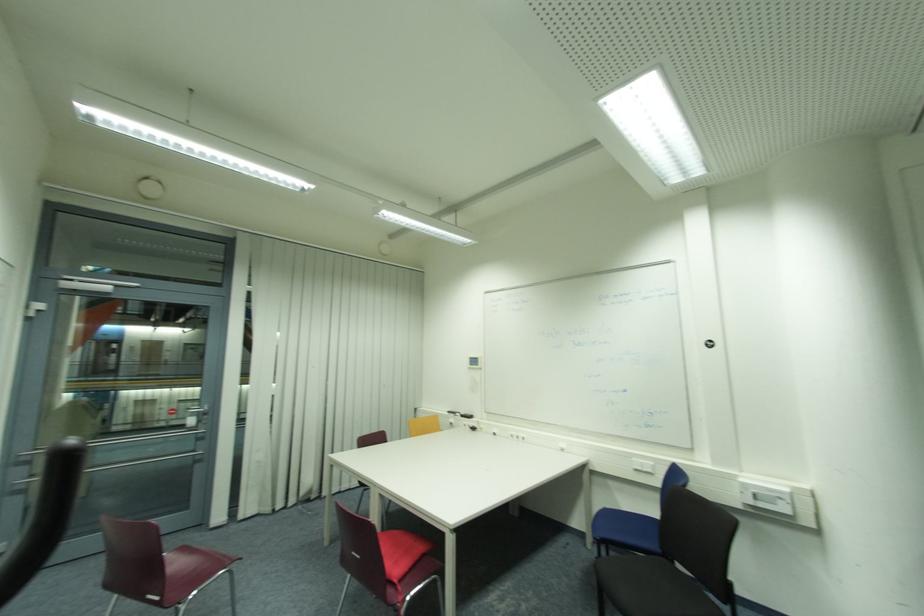
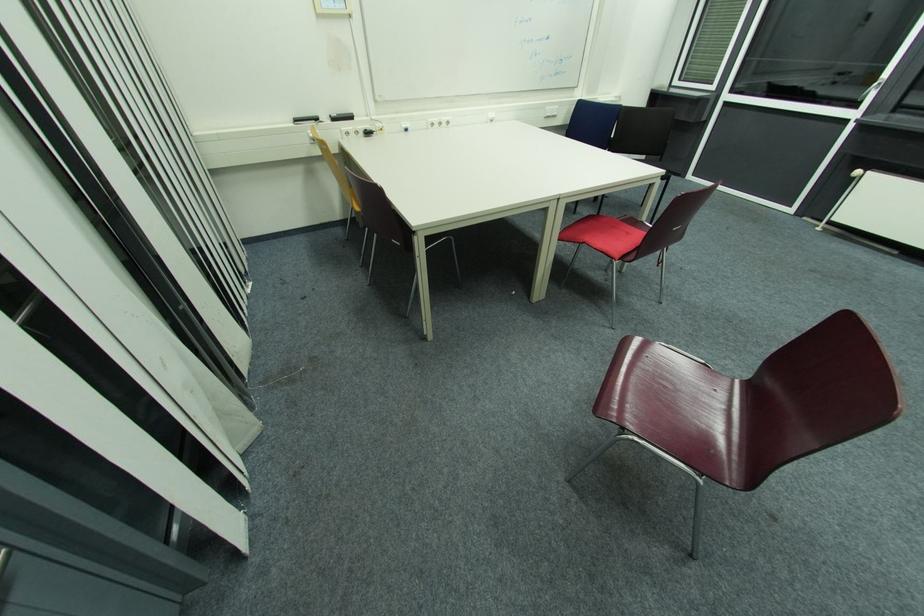
In the second image, find the point that corresponds to [466,416] in the first image.

(337, 121)